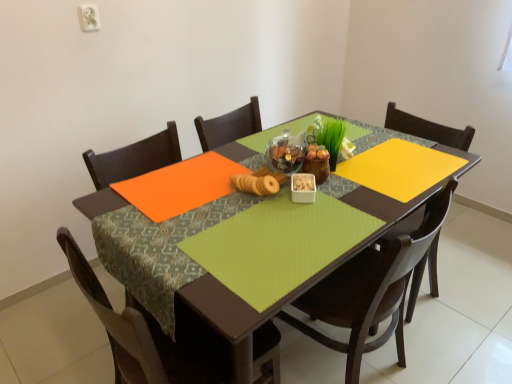
Describe the element at coordinates (259, 182) in the screenshot. I see `matte brown cookies at center` at that location.

The width and height of the screenshot is (512, 384). Describe the element at coordinates (151, 335) in the screenshot. I see `brown wood chair at lower left, which ranks as the 1th chair in left-to-right order` at that location.

Describe the element at coordinates (303, 188) in the screenshot. I see `white plastic container at center` at that location.

The height and width of the screenshot is (384, 512). Describe the element at coordinates (221, 306) in the screenshot. I see `green fabric table at center` at that location.

I want to click on matte brown cookies at center, so click(259, 182).

Considering the relative sizes of matte wood chair at center, which appears as the 1th chair when viewed from the right, and green fabric table at center in the image provided, is matte wood chair at center, which appears as the 1th chair when viewed from the right, shorter than green fabric table at center?

Incorrect, the height of matte wood chair at center, which appears as the 1th chair when viewed from the right, does not fall short of that of green fabric table at center.

From the picture: Which object is positioned more to the left, matte wood chair at center, the second chair from the left, or green fabric table at center?

From the viewer's perspective, green fabric table at center appears more on the left side.

Can you tell me how much matte wood chair at center, the second chair from the left, and green fabric table at center differ in facing direction?

The facing directions of matte wood chair at center, the second chair from the left, and green fabric table at center are 174 degrees apart.

Is matte wood chair at center, which appears as the 1th chair when viewed from the right, completely or partially outside of green fabric table at center?

No, matte wood chair at center, which appears as the 1th chair when viewed from the right, is not entirely external to green fabric table at center.

Between brown wood chair at lower left, the second chair in the right-to-left sequence, and white plastic container at center, which one has less height?

With less height is white plastic container at center.

Considering the positions of objects brown wood chair at lower left, the second chair in the right-to-left sequence, and white plastic container at center in the image provided, who is more to the left, brown wood chair at lower left, the second chair in the right-to-left sequence, or white plastic container at center?

Positioned to the left is brown wood chair at lower left, the second chair in the right-to-left sequence.

From the image's perspective, is brown wood chair at lower left, which ranks as the 1th chair in left-to-right order, located beneath white plastic container at center?

Yes.

Would you say brown wood chair at lower left, the second chair in the right-to-left sequence, contains white plastic container at center?

No, white plastic container at center is not surrounded by brown wood chair at lower left, the second chair in the right-to-left sequence.

From the picture: Is brown wood chair at lower left, which ranks as the 1th chair in left-to-right order, looking in the opposite direction of matte brown cookies at center?

No.

Considering the relative positions of brown wood chair at lower left, the second chair in the right-to-left sequence, and matte brown cookies at center in the image provided, is brown wood chair at lower left, the second chair in the right-to-left sequence, to the left of matte brown cookies at center from the viewer's perspective?

Yes.

Consider the image. Who is more distant, brown wood chair at lower left, the second chair in the right-to-left sequence, or matte brown cookies at center?

matte brown cookies at center is further away from the camera.

Is point (201, 358) more distant than point (79, 208)?

That is False.

Looking at this image, considering the sizes of brown wood chair at lower left, the second chair in the right-to-left sequence, and green fabric table at center in the image, is brown wood chair at lower left, the second chair in the right-to-left sequence, bigger or smaller than green fabric table at center?

Clearly, brown wood chair at lower left, the second chair in the right-to-left sequence, is smaller in size than green fabric table at center.

Is brown wood chair at lower left, which ranks as the 1th chair in left-to-right order, in front of or behind green fabric table at center in the image?

In the image, brown wood chair at lower left, which ranks as the 1th chair in left-to-right order, appears in front of green fabric table at center.

Is brown wood chair at lower left, which ranks as the 1th chair in left-to-right order, looking in the opposite direction of green fabric table at center?

Yes, brown wood chair at lower left, which ranks as the 1th chair in left-to-right order, is positioned with its back facing green fabric table at center.

From the picture: Could matte brown cookies at center be considered to be inside green fabric table at center?

No, matte brown cookies at center is not surrounded by green fabric table at center.

Is green fabric table at center far from matte brown cookies at center?

They are positioned close to each other.

Considering the relative sizes of green fabric table at center and matte brown cookies at center in the image provided, is green fabric table at center bigger than matte brown cookies at center?

Yes.

Considering the positions of objects green fabric table at center and matte brown cookies at center in the image provided, who is more to the right, green fabric table at center or matte brown cookies at center?

From the viewer's perspective, green fabric table at center appears more on the right side.

Which object is wider, white plastic container at center or brown wood chair at lower left, which ranks as the 1th chair in left-to-right order?

brown wood chair at lower left, which ranks as the 1th chair in left-to-right order, is wider.

Between white plastic container at center and brown wood chair at lower left, which ranks as the 1th chair in left-to-right order, which one has more height?

brown wood chair at lower left, which ranks as the 1th chair in left-to-right order.

Does white plastic container at center turn towards brown wood chair at lower left, which ranks as the 1th chair in left-to-right order?

No, white plastic container at center is not turned towards brown wood chair at lower left, which ranks as the 1th chair in left-to-right order.

Is white plastic container at center far from brown wood chair at lower left, which ranks as the 1th chair in left-to-right order?

white plastic container at center is near brown wood chair at lower left, which ranks as the 1th chair in left-to-right order, not far away.

From the image's perspective, would you say matte wood chair at center, which appears as the 1th chair when viewed from the right, is positioned over white plastic container at center?

Incorrect, from the image's perspective, matte wood chair at center, which appears as the 1th chair when viewed from the right, is lower than white plastic container at center.

Which is in front, point (415, 292) or point (303, 194)?

The point (303, 194) is in front.

Are matte wood chair at center, which appears as the 1th chair when viewed from the right, and white plastic container at center beside each other?

They are not placed beside each other.

Find the location of a particular element. This screenshot has width=512, height=384. table on the left of matte wood chair at center, which appears as the 1th chair when viewed from the right is located at coordinates (221, 306).

This screenshot has width=512, height=384. What are the coordinates of `chair that is the 2nd one when counting downward from the white plastic container at center (from the image's perspective)` in the screenshot? It's located at (151, 335).

Estimate the real-world distances between objects in this image. Which object is further from green fabric table at center, matte brown cookies at center or matte wood chair at center, the second chair from the left?

The object further to green fabric table at center is matte brown cookies at center.

When comparing their distances from brown wood chair at lower left, the second chair in the right-to-left sequence, does white plastic container at center or matte wood chair at center, which appears as the 1th chair when viewed from the right, seem closer?

matte wood chair at center, which appears as the 1th chair when viewed from the right.

When comparing their distances from white plastic container at center, does matte brown cookies at center or brown wood chair at lower left, the second chair in the right-to-left sequence, seem closer?

matte brown cookies at center lies closer to white plastic container at center than the other object.

In the scene shown: Looking at the image, which one is located further to green fabric table at center, white plastic container at center or matte brown cookies at center?

matte brown cookies at center is further to green fabric table at center.

Estimate the real-world distances between objects in this image. Which object is further from green fabric table at center, matte wood chair at center, which appears as the 1th chair when viewed from the right, or brown wood chair at lower left, which ranks as the 1th chair in left-to-right order?

brown wood chair at lower left, which ranks as the 1th chair in left-to-right order, lies further to green fabric table at center than the other object.

In the scene shown: Estimate the real-world distances between objects in this image. Which object is further from white plastic container at center, green fabric table at center or brown wood chair at lower left, the second chair in the right-to-left sequence?

brown wood chair at lower left, the second chair in the right-to-left sequence, is further to white plastic container at center.

Looking at the image, which one is located closer to matte brown cookies at center, brown wood chair at lower left, which ranks as the 1th chair in left-to-right order, or matte wood chair at center, the second chair from the left?

Among the two, matte wood chair at center, the second chair from the left, is located nearer to matte brown cookies at center.

When comparing their distances from brown wood chair at lower left, which ranks as the 1th chair in left-to-right order, does matte brown cookies at center or matte wood chair at center, the second chair from the left, seem closer?

matte wood chair at center, the second chair from the left, is positioned closer to the anchor brown wood chair at lower left, which ranks as the 1th chair in left-to-right order.

You are a GUI agent. You are given a task and a screenshot of the screen. Output one action in this format:
    pyautogui.click(x=<x>, y=<y>)
    Task: Click on the food positioned between green fabric table at center and white plastic container at center from near to far
    This screenshot has width=512, height=384.
    Given the screenshot: What is the action you would take?
    pyautogui.click(x=259, y=182)

I want to click on table situated between brown wood chair at lower left, which ranks as the 1th chair in left-to-right order, and matte wood chair at center, the second chair from the left, from left to right, so click(x=221, y=306).

At what (x,y) coordinates should I click in order to perform the action: click on table between white plastic container at center and brown wood chair at lower left, the second chair in the right-to-left sequence, in the up-down direction. Please return your answer as a coordinate pair (x, y). This screenshot has height=384, width=512. Looking at the image, I should click on (221, 306).

Identify the location of tableware between matte brown cookies at center and matte wood chair at center, the second chair from the left, from top to bottom. (303, 188).